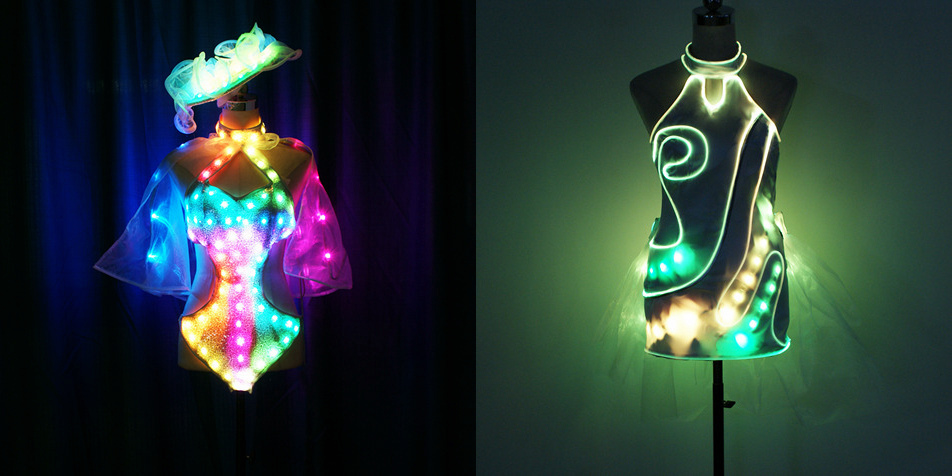
Where is `curtain`? This screenshot has height=476, width=952. curtain is located at coordinates (98, 201).